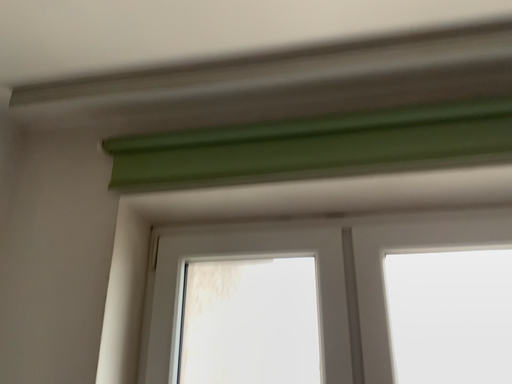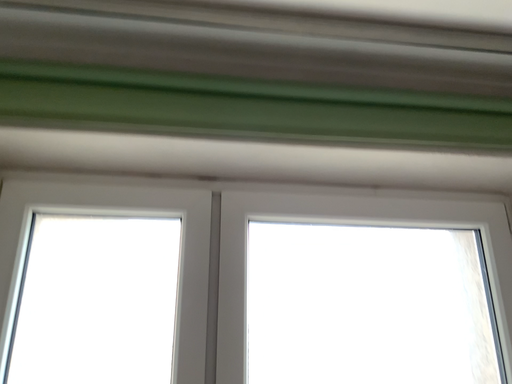
Question: How did the camera likely rotate when shooting the video?

Choices:
 (A) rotated left
 (B) rotated right

Answer: (B)